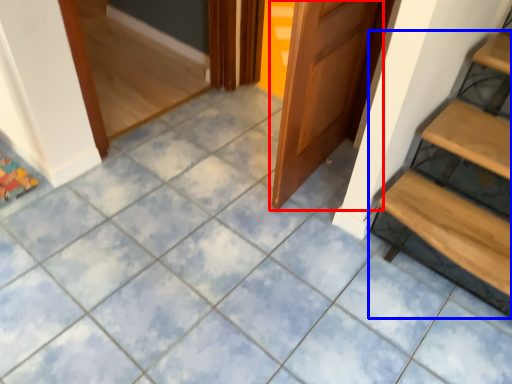
Question: Which object is closer to the camera taking this photo, door (highlighted by a red box) or stairs (highlighted by a blue box)?

Choices:
 (A) door
 (B) stairs

Answer: (A)